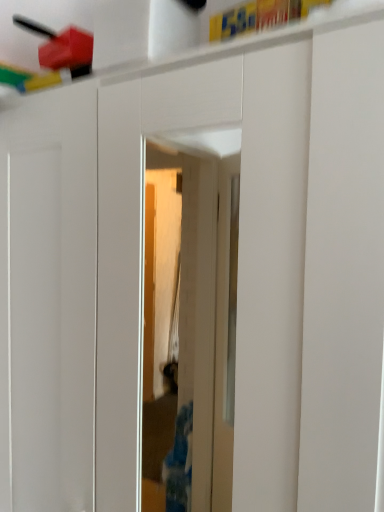
This screenshot has width=384, height=512. Identify the location of rubberized red block at upper left. (51, 57).

Describe the element at coordinates (51, 57) in the screenshot. I see `rubberized red block at upper left` at that location.

Identify the location of rubberized red block at upper left. (51, 57).